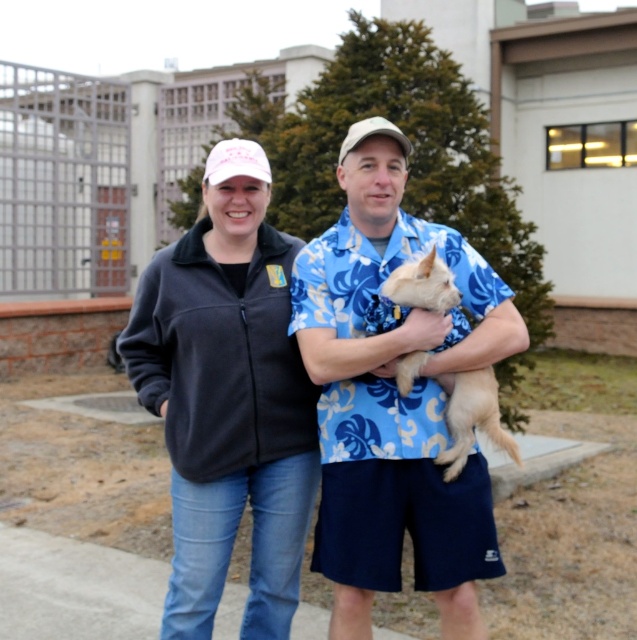
Who is more distant from viewer, [478,556] or [412,278]?

The point [478,556] is more distant.

This screenshot has height=640, width=637. What do you see at coordinates (394, 397) in the screenshot?
I see `matte black jacket at center` at bounding box center [394, 397].

You are a GUI agent. You are given a task and a screenshot of the screen. Output one action in this format:
    pyautogui.click(x=<x>, y=<y>)
    Task: Click on the matte black jacket at center
    
    Given the screenshot: What is the action you would take?
    pyautogui.click(x=394, y=397)

The width and height of the screenshot is (637, 640). What are the coordinates of `matte black jacket at center` in the screenshot? It's located at (394, 397).

Is black fleece jacket at center taller than fuzzy beige dog at center?

Yes.

What do you see at coordinates (227, 400) in the screenshot? I see `black fleece jacket at center` at bounding box center [227, 400].

Image resolution: width=637 pixels, height=640 pixels. Identify the location of black fleece jacket at center. (227, 400).

Between point (371, 573) and point (220, 170), which one is positioned behind?

Positioned behind is point (220, 170).

Is point (434, 397) behind point (280, 296)?

No, (434, 397) is closer to viewer.

Is point (466, 465) closer to camera compared to point (204, 260)?

Yes, point (466, 465) is closer to viewer.

The width and height of the screenshot is (637, 640). I want to click on matte black jacket at center, so click(394, 397).